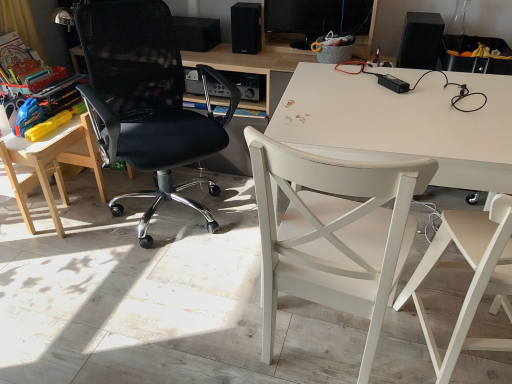
Where is `space that is in front of wooden table at left`? space that is in front of wooden table at left is located at coordinates (61, 255).